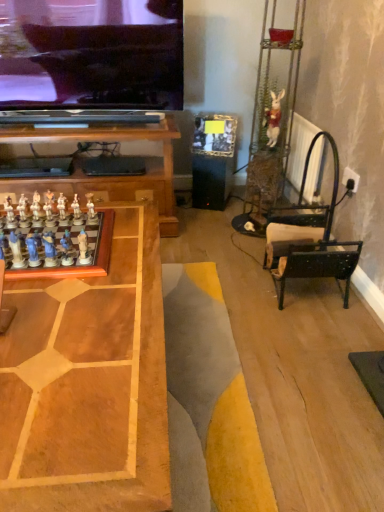
Identify the location of vacant area to the right of matte blue chess piece at left, which is the eighth toy from back to front. The width and height of the screenshot is (384, 512). (118, 266).